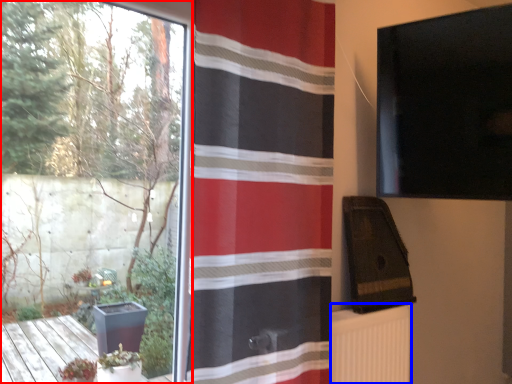
Question: Which object appears closest to the camera in this image, window (highlighted by a red box) or radiator (highlighted by a blue box)?

Choices:
 (A) window
 (B) radiator

Answer: (A)